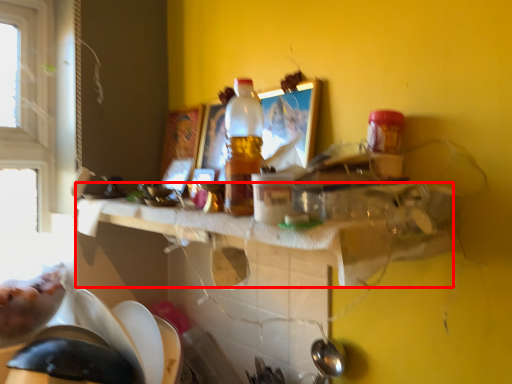
Question: From the image's perspective, where is counter top (annotated by the red box) located relative to bottle?

Choices:
 (A) below
 (B) above

Answer: (A)